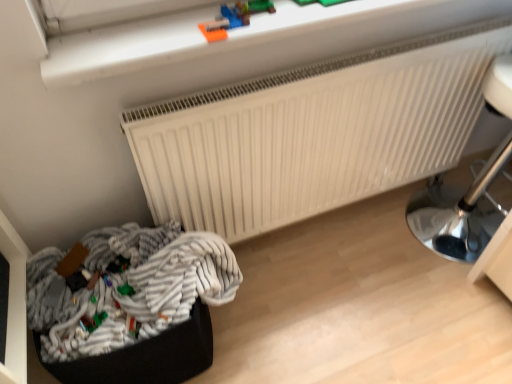
Question: Does striped fabric laundry at lower left have a greater height compared to smooth plastic toy at upper center, which ranks as the first toy in top-to-bottom order?

Choices:
 (A) no
 (B) yes

Answer: (B)

Question: From the image's perspective, is striped fabric laundry at lower left located above smooth plastic toy at upper center, the first toy viewed from the right?

Choices:
 (A) no
 (B) yes

Answer: (A)

Question: Is striped fabric laundry at lower left facing away from smooth plastic toy at upper center, the 3th toy when ordered from bottom to top?

Choices:
 (A) no
 (B) yes

Answer: (A)

Question: Is striped fabric laundry at lower left located outside smooth plastic toy at upper center, which is the 3th toy from left to right?

Choices:
 (A) no
 (B) yes

Answer: (B)

Question: Can you confirm if striped fabric laundry at lower left is positioned to the left of smooth plastic toy at upper center, which is the 3th toy from left to right?

Choices:
 (A) no
 (B) yes

Answer: (B)

Question: In the image, is smooth plastic toy at upper center, which ranks as the first toy in top-to-bottom order, on the left side or the right side of green matte toy at lower left, which is counted as the second toy, starting from the left?

Choices:
 (A) right
 (B) left

Answer: (A)

Question: Is point (202, 23) positioned closer to the camera than point (132, 292)?

Choices:
 (A) farther
 (B) closer

Answer: (B)

Question: Looking at the image, does smooth plastic toy at upper center, the first toy viewed from the right, seem bigger or smaller compared to green matte toy at lower left, which is counted as the second toy, starting from the left?

Choices:
 (A) big
 (B) small

Answer: (A)

Question: From their relative heights in the image, would you say smooth plastic toy at upper center, the 3th toy when ordered from bottom to top, is taller or shorter than green matte toy at lower left, which is counted as the second toy, starting from the left?

Choices:
 (A) tall
 (B) short

Answer: (A)

Question: Considering the positions of smooth plastic toy at upper center, which is the 3th toy from left to right, and striped fabric laundry at lower left in the image, is smooth plastic toy at upper center, which is the 3th toy from left to right, wider or thinner than striped fabric laundry at lower left?

Choices:
 (A) wide
 (B) thin

Answer: (B)

Question: Based on their positions, is smooth plastic toy at upper center, the first toy viewed from the right, located to the left or right of striped fabric laundry at lower left?

Choices:
 (A) right
 (B) left

Answer: (A)

Question: From a real-world perspective, relative to striped fabric laundry at lower left, is smooth plastic toy at upper center, which is the 3th toy from left to right, vertically above or below?

Choices:
 (A) above
 (B) below

Answer: (A)

Question: Choose the correct answer: Is smooth plastic toy at upper center, which is the 3th toy from left to right, inside striped fabric laundry at lower left or outside it?

Choices:
 (A) outside
 (B) inside

Answer: (A)

Question: From the image's perspective, is green plastic toy at lower left, which ranks as the first toy in left-to-right order, located above or below green matte toy at lower left, which is the second toy from right to left?

Choices:
 (A) below
 (B) above

Answer: (A)

Question: Relative to green matte toy at lower left, the second toy ordered from the bottom, is green plastic toy at lower left, arranged as the 3th toy when viewed from the top, in front or behind?

Choices:
 (A) behind
 (B) front

Answer: (B)